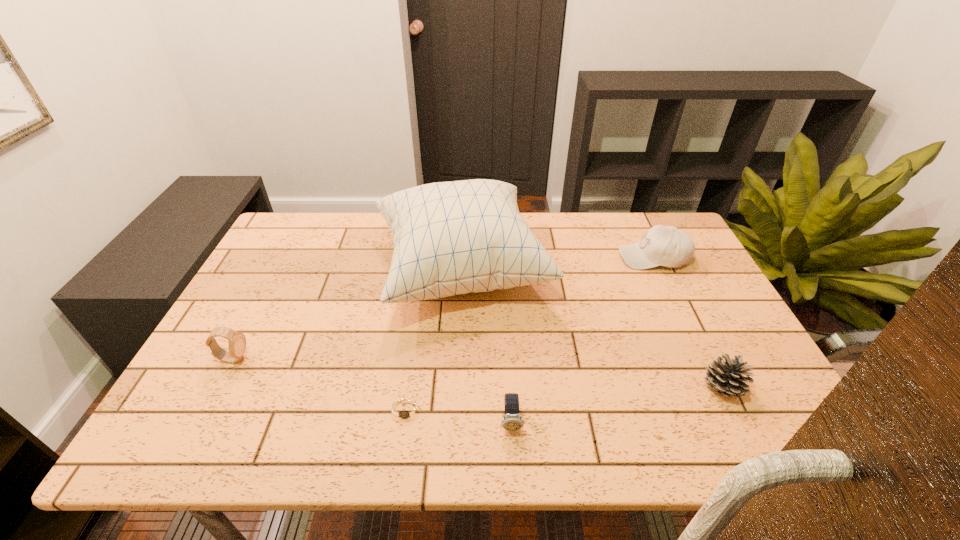
Point out which watch is positioned as the second nearest to the baseball cap. Please provide its 2D coordinates. Your answer should be formatted as a tuple, i.e. [(x, y)], where the tuple contains the x and y coordinates of a point satisfying the conditions above.

[(407, 410)]

Locate an element on the screen. Image resolution: width=960 pixels, height=540 pixels. vacant point that satisfies the following two spatial constraints: 1. on the face of the leftmost object; 2. on the back side of the pinecone is located at coordinates (217, 388).

This screenshot has width=960, height=540. In order to click on free spot that satisfies the following two spatial constraints: 1. on the face of the farthest watch; 2. on the right side of the pinecone in this screenshot , I will do `click(217, 388)`.

Where is `vacant area that satisfies the following two spatial constraints: 1. on the back side of the pinecone; 2. on the front-facing side of the baseball cap`? The image size is (960, 540). vacant area that satisfies the following two spatial constraints: 1. on the back side of the pinecone; 2. on the front-facing side of the baseball cap is located at coordinates (659, 257).

Where is `vacant area in the image that satisfies the following two spatial constraints: 1. on the front-facing side of the baseball cap; 2. on the face of the second shortest object`? Image resolution: width=960 pixels, height=540 pixels. vacant area in the image that satisfies the following two spatial constraints: 1. on the front-facing side of the baseball cap; 2. on the face of the second shortest object is located at coordinates (732, 422).

You are a GUI agent. You are given a task and a screenshot of the screen. Output one action in this format:
    pyautogui.click(x=<x>, y=<y>)
    Task: Click on the vacant space that satisfies the following two spatial constraints: 1. on the face of the tallest watch; 2. on the left side of the pinecone
    This screenshot has width=960, height=540.
    Given the screenshot: What is the action you would take?
    pyautogui.click(x=217, y=388)